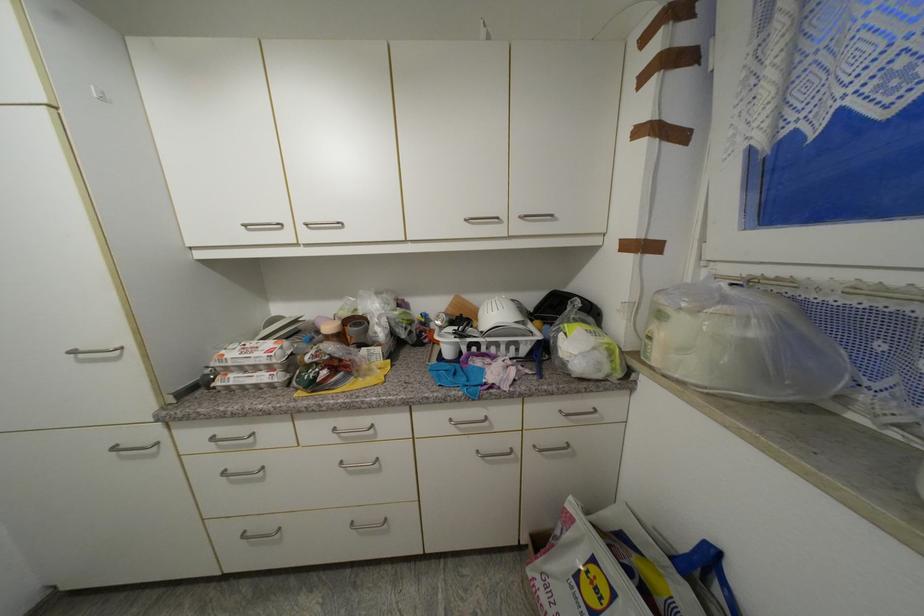
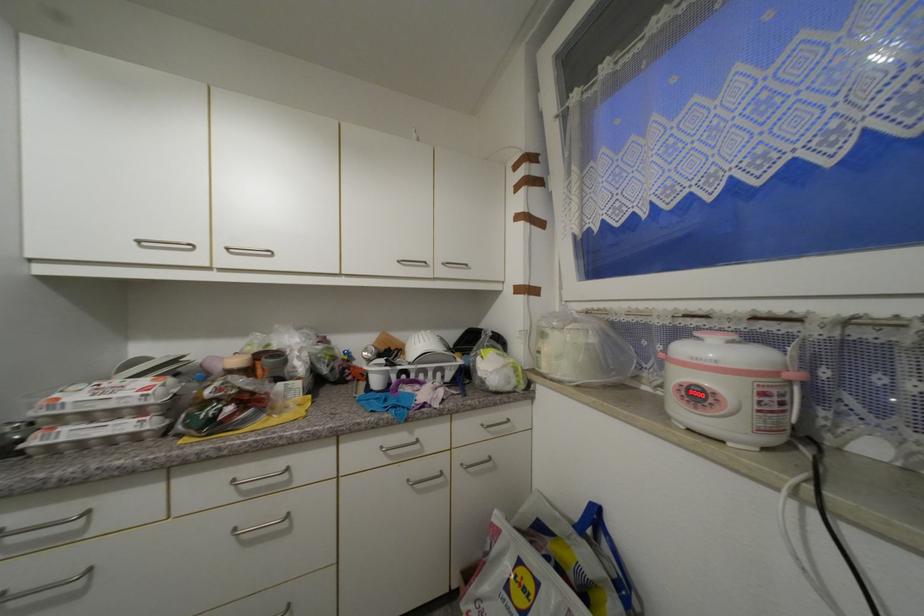
Where in the second image is the point corresponding to point (228, 357) from the first image?

(64, 400)